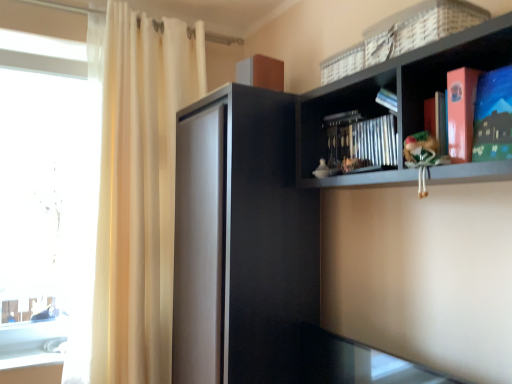
Question: From the image's perspective, is white woven basket at upper right located beneath matte paper book at upper right?

Choices:
 (A) yes
 (B) no

Answer: (B)

Question: Is white woven basket at upper right positioned beyond the bounds of matte paper book at upper right?

Choices:
 (A) no
 (B) yes

Answer: (B)

Question: Considering the relative sizes of white woven basket at upper right and matte paper book at upper right in the image provided, is white woven basket at upper right wider than matte paper book at upper right?

Choices:
 (A) yes
 (B) no

Answer: (A)

Question: From a real-world perspective, is white woven basket at upper right physically above matte paper book at upper right?

Choices:
 (A) yes
 (B) no

Answer: (A)

Question: Is white woven basket at upper right shorter than matte paper book at upper right?

Choices:
 (A) yes
 (B) no

Answer: (A)

Question: Is white woven basket at upper right wider or thinner than matte paper book at upper right?

Choices:
 (A) thin
 (B) wide

Answer: (B)

Question: Considering the positions of point 470,14 and point 501,102, is point 470,14 closer or farther from the camera than point 501,102?

Choices:
 (A) closer
 (B) farther

Answer: (B)

Question: Is white woven basket at upper right in front of or behind matte paper book at upper right in the image?

Choices:
 (A) behind
 (B) front

Answer: (A)

Question: Considering the positions of white woven basket at upper right and matte paper book at upper right in the image, is white woven basket at upper right bigger or smaller than matte paper book at upper right?

Choices:
 (A) small
 (B) big

Answer: (B)

Question: Based on their sizes in the image, would you say black matte cabinet at center is bigger or smaller than metallic silver book at center?

Choices:
 (A) big
 (B) small

Answer: (A)

Question: Is black matte cabinet at center to the left or to the right of metallic silver book at center in the image?

Choices:
 (A) right
 (B) left

Answer: (B)

Question: Is black matte cabinet at center taller or shorter than metallic silver book at center?

Choices:
 (A) short
 (B) tall

Answer: (B)

Question: From the image's perspective, relative to metallic silver book at center, is black matte cabinet at center above or below?

Choices:
 (A) above
 (B) below

Answer: (B)

Question: Is point [x=504, y=115] positioned closer to the camera than point [x=415, y=26]?

Choices:
 (A) farther
 (B) closer

Answer: (B)

Question: Would you say matte paper book at upper right is inside or outside white woven basket at upper right?

Choices:
 (A) inside
 (B) outside

Answer: (B)